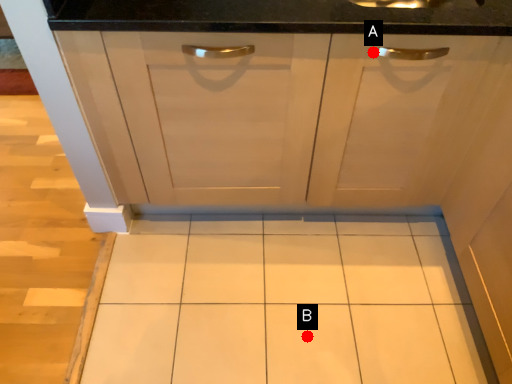
Question: Two points are circled on the image, labeled by A and B beside each circle. Which point is farther to the camera?

Choices:
 (A) A is further
 (B) B is further

Answer: (B)